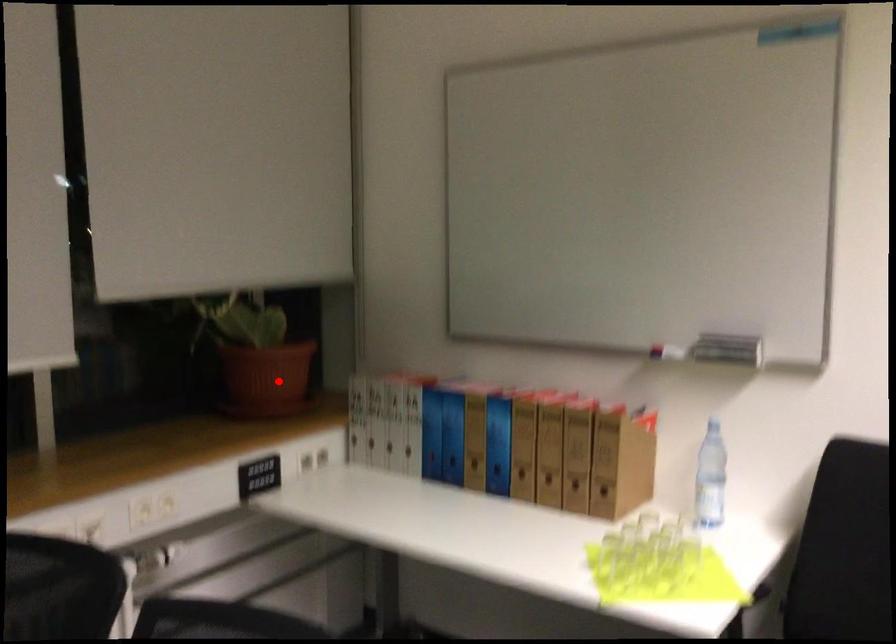
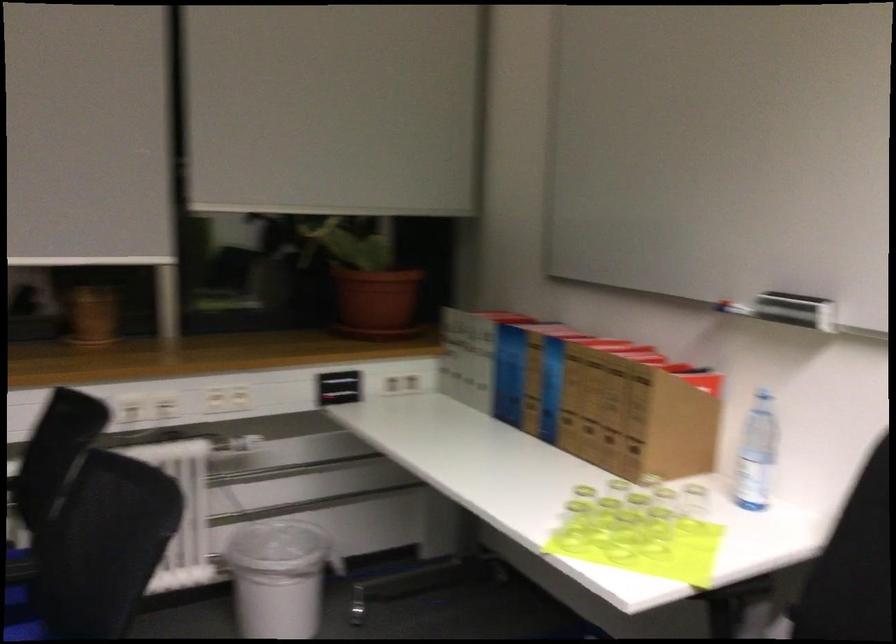
Question: I am providing you with two images of the same scene from different viewpoints. A red point is marked on the first image. Is the red point's position out of view in image 2?

Choices:
 (A) Yes
 (B) No

Answer: (B)